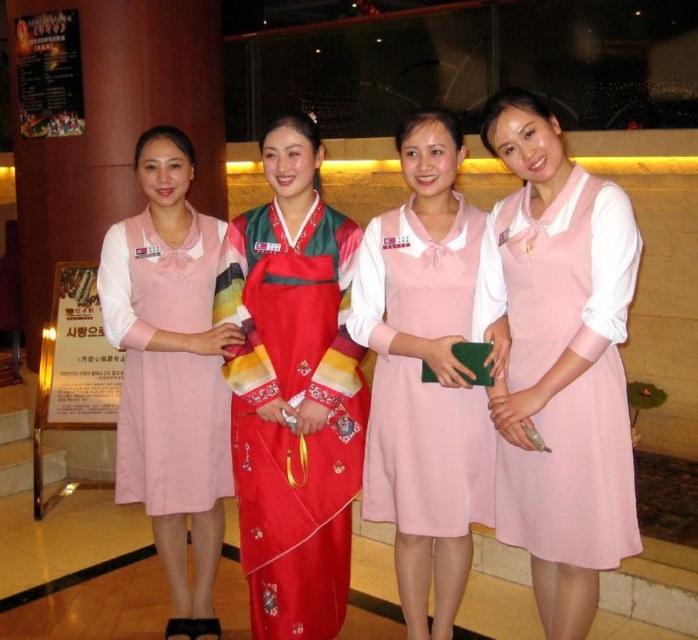
You are a photographer at the event and want to capture a photo of the matte pink dress at center without the red satin hanbok at center blocking it. What should you do?

Move to a position where the matte pink dress at center is no longer behind the red satin hanbok at center, since the matte pink dress at center is currently positioned behind the red satin hanbok at center.

You are planning to take a photo of the red satin hanbok at center and the pink fabric dress at right. Since you want both to be visible in the frame, which one should you focus on to ensure the taller one is fully captured?

You should focus on the red satin hanbok at center because it is much taller than the pink fabric dress at right, ensuring it fits within the frame.

You are a photographer standing in the lobby and want to take a photo of the red satin hanbok at center and the matte pink dress at center. The camera you are using has a minimum focus distance of 12 inches. Will you be able to capture both subjects clearly in the same frame without moving either of them?

The distance between the red satin hanbok at center and the matte pink dress at center is 11.33 inches, which is less than the camera minimum focus distance of 12 inches. Therefore, the camera cannot focus on both subjects clearly in the same frame without moving them.